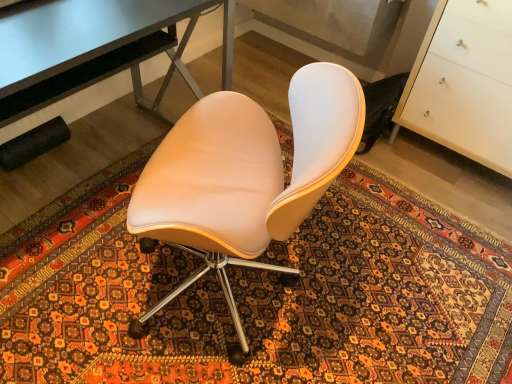
Measure the distance between white glossy cabinet at right and camera.

white glossy cabinet at right and camera are 4.95 feet apart.

Where is `patterned carpet at center`? patterned carpet at center is located at coordinates (258, 295).

The height and width of the screenshot is (384, 512). Describe the element at coordinates (95, 48) in the screenshot. I see `metallic gray desk at upper left` at that location.

What are the coordinates of `white glossy cabinet at right` in the screenshot? It's located at coord(464,82).

Is white glossy cabinet at right positioned beyond the bounds of metallic gray desk at upper left?

Indeed, white glossy cabinet at right is completely outside metallic gray desk at upper left.

Considering the relative sizes of white glossy cabinet at right and metallic gray desk at upper left in the image provided, is white glossy cabinet at right thinner than metallic gray desk at upper left?

In fact, white glossy cabinet at right might be wider than metallic gray desk at upper left.

From the image's perspective, is white glossy cabinet at right positioned above or below metallic gray desk at upper left?

From the image's perspective, white glossy cabinet at right appears below metallic gray desk at upper left.

Does point (433, 54) appear closer or farther from the camera than point (57, 75)?

Point (433, 54) is farther from the camera than point (57, 75).

Looking at this image, relative to metallic gray desk at upper left, is matte beige chair at center in front or behind?

matte beige chair at center is positioned closer to the viewer than metallic gray desk at upper left.

Considering the positions of points (139, 182) and (223, 53), is point (139, 182) farther from camera compared to point (223, 53)?

No, it is not.

Which of these two, matte beige chair at center or metallic gray desk at upper left, is thinner?

metallic gray desk at upper left.

I want to click on desk behind the matte beige chair at center, so coord(95,48).

How many degrees apart are the facing directions of metallic gray desk at upper left and matte beige chair at center?

The facing directions of metallic gray desk at upper left and matte beige chair at center are 153 degrees apart.

Between metallic gray desk at upper left and matte beige chair at center, which one has smaller width?

metallic gray desk at upper left.

From the image's perspective, is white glossy cabinet at right below matte beige chair at center?

No, from the image's perspective, white glossy cabinet at right is not below matte beige chair at center.

Locate an element on the screen. chair located in front of the white glossy cabinet at right is located at coordinates (244, 176).

Is white glossy cabinet at right not close to matte beige chair at center?

Yes.

Is point (505, 58) positioned in front of point (191, 228)?

No, it is behind (191, 228).

Is patterned carpet at center in contact with matte beige chair at center?

patterned carpet at center and matte beige chair at center are clearly separated.

Can you tell me how much patterned carpet at center and matte beige chair at center differ in facing direction?

153 degrees.

Measure the distance between patterned carpet at center and matte beige chair at center.

A distance of 25.52 inches exists between patterned carpet at center and matte beige chair at center.

Does patterned carpet at center come in front of matte beige chair at center?

No, patterned carpet at center is further to the viewer.

Considering the sizes of objects matte beige chair at center and white glossy cabinet at right in the image provided, who is taller, matte beige chair at center or white glossy cabinet at right?

Standing taller between the two is matte beige chair at center.

Between matte beige chair at center and white glossy cabinet at right, which one is positioned in front?

Positioned in front is matte beige chair at center.

Is matte beige chair at center not close to white glossy cabinet at right?

Yes.

From the image's perspective, who appears lower, metallic gray desk at upper left or white glossy cabinet at right?

white glossy cabinet at right.

Locate an element on the screen. Image resolution: width=512 pixels, height=384 pixels. cabinetry that appears in front of the metallic gray desk at upper left is located at coordinates (464, 82).

Considering the sizes of objects metallic gray desk at upper left and white glossy cabinet at right in the image provided, who is taller, metallic gray desk at upper left or white glossy cabinet at right?

With more height is white glossy cabinet at right.

What's the angular difference between metallic gray desk at upper left and white glossy cabinet at right's facing directions?

The angular difference between metallic gray desk at upper left and white glossy cabinet at right is 89.2 degrees.

The image size is (512, 384). In order to click on desk below the white glossy cabinet at right (from a real-world perspective) in this screenshot , I will do `click(95, 48)`.

Image resolution: width=512 pixels, height=384 pixels. I want to click on chair located on the right of metallic gray desk at upper left, so click(244, 176).

Consider the image. Based on their spatial positions, is white glossy cabinet at right or metallic gray desk at upper left closer to patterned carpet at center?

white glossy cabinet at right.

Considering their positions, is metallic gray desk at upper left positioned closer to white glossy cabinet at right than patterned carpet at center?

patterned carpet at center.

Estimate the real-world distances between objects in this image. Which object is further from patterned carpet at center, white glossy cabinet at right or matte beige chair at center?

white glossy cabinet at right.

Looking at the image, which one is located closer to white glossy cabinet at right, matte beige chair at center or patterned carpet at center?

patterned carpet at center is positioned closer to the anchor white glossy cabinet at right.

Looking at the image, which one is located closer to metallic gray desk at upper left, matte beige chair at center or white glossy cabinet at right?

The object closer to metallic gray desk at upper left is matte beige chair at center.

From the image, which object appears to be nearer to white glossy cabinet at right, metallic gray desk at upper left or matte beige chair at center?

Based on the image, matte beige chair at center appears to be nearer to white glossy cabinet at right.

Consider the image. Looking at the image, which one is located closer to white glossy cabinet at right, patterned carpet at center or metallic gray desk at upper left?

patterned carpet at center is positioned closer to the anchor white glossy cabinet at right.

Looking at the image, which one is located further to metallic gray desk at upper left, patterned carpet at center or white glossy cabinet at right?

white glossy cabinet at right is further to metallic gray desk at upper left.

This screenshot has height=384, width=512. In order to click on mat located between metallic gray desk at upper left and white glossy cabinet at right in the left-right direction in this screenshot , I will do `click(258, 295)`.

Where is `mat between matte beige chair at center and metallic gray desk at upper left in the front-back direction`? mat between matte beige chair at center and metallic gray desk at upper left in the front-back direction is located at coordinates (258, 295).

Identify the location of mat situated between matte beige chair at center and white glossy cabinet at right from left to right. (258, 295).

At what (x,y) coordinates should I click in order to perform the action: click on chair situated between metallic gray desk at upper left and white glossy cabinet at right from left to right. Please return your answer as a coordinate pair (x, y). This screenshot has width=512, height=384. Looking at the image, I should click on (244, 176).